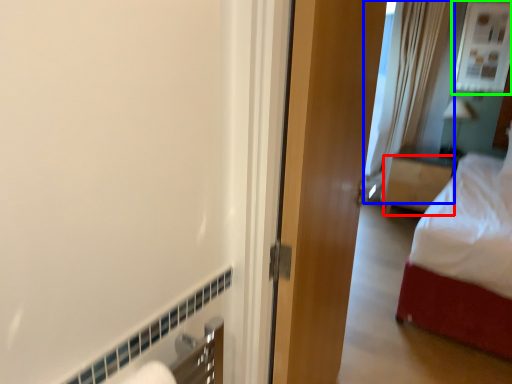
Question: Which object is positioned closest to furniture (highlighted by a red box)? Select from shower curtain (highlighted by a blue box) and window (highlighted by a green box).

Choices:
 (A) shower curtain
 (B) window

Answer: (A)